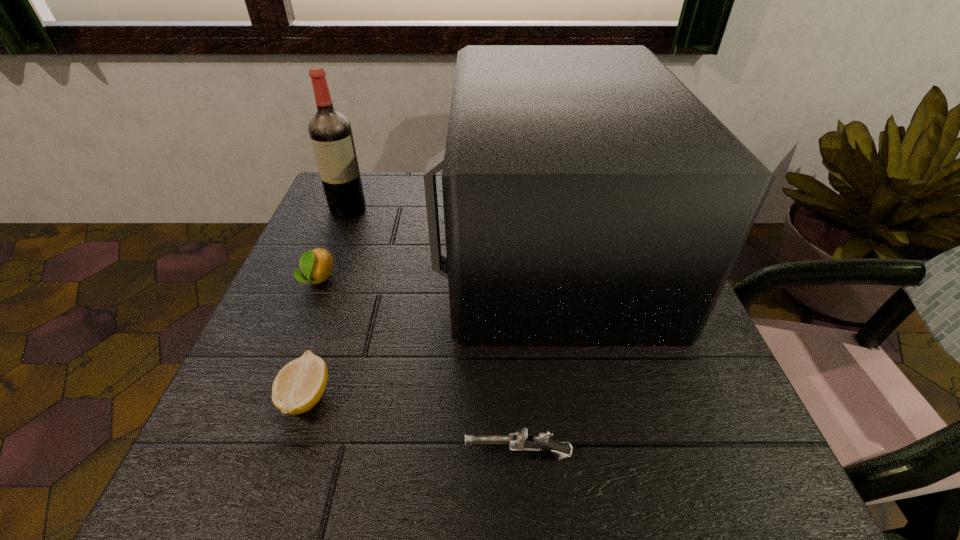
Find the location of a particular element. This screenshot has height=540, width=960. microwave oven is located at coordinates (590, 198).

Image resolution: width=960 pixels, height=540 pixels. What are the coordinates of `liquor` in the screenshot? It's located at (330, 132).

The height and width of the screenshot is (540, 960). I want to click on the farther lemon, so click(x=316, y=265).

Locate an element on the screen. The height and width of the screenshot is (540, 960). the nearest object is located at coordinates [522, 440].

At what (x,y) coordinates should I click in order to perform the action: click on the shorter lemon. Please return your answer as a coordinate pair (x, y). The width and height of the screenshot is (960, 540). Looking at the image, I should click on (299, 385).

Where is `the shortest object`? The height and width of the screenshot is (540, 960). the shortest object is located at coordinates (299, 385).

Identify the location of vacant position located 0.050m on the front-facing side of the microwave oven. (420, 245).

This screenshot has height=540, width=960. In order to click on free region located 0.070m on the front-facing side of the microwave oven in this screenshot , I will do `click(410, 245)`.

In order to click on free space located on the front-facing side of the microwave oven in this screenshot , I will do `click(358, 245)`.

At what (x,y) coordinates should I click in order to perform the action: click on blank area located on the front-facing side of the liquor. Please return your answer as a coordinate pair (x, y). Looking at the image, I should click on (329, 255).